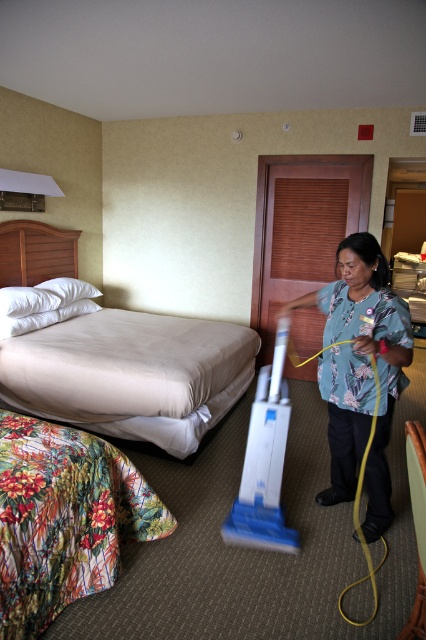
You are standing in the hotel room and want to check if a 12 feet long ladder can be placed horizontally from your current position to the point at coordinates point [36,259]. Can it fit without exceeding the room dimensions?

The distance from the viewer to point [36,259] is 14.42 feet, which is longer than the 12 feet ladder. Therefore, the ladder cannot reach that point.

You are a guest in this hotel room and want to place your luggage. The beige fabric bed at left and the floral print shirt at center are in your way. Which object should you move to make space?

The beige fabric bed at left is bigger than the floral print shirt at center, so you should move the floral print shirt at center to make space.

You are a guest entering the hotel room and see the beige fabric bed at left and the floral print shirt at center. Which object is closer to the entrance?

The beige fabric bed at left is closer to the entrance because it is positioned over the floral print shirt at center, indicating it is in front.